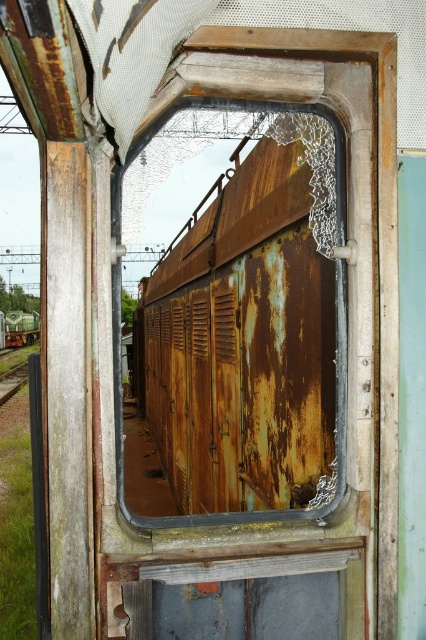
You are a maintenance worker inspecting the train car window. You notice the rusty metal train at left and the brown wooden train track at left. Which object is closer to the left edge of the window?

The rusty metal train at left is positioned on the left side of the brown wooden train track at left, so it is closer to the left edge of the window.

You are standing in front of two rusty metal trains. The first is the rusty metal train at center and the second is the rusty metal train at left. Which one is located to the right of the other?

The rusty metal train at center is positioned on the right side of the rusty metal train at left, so the rusty metal train at center is to the right of the rusty metal train at left.

You are standing in front of an old train car window and notice two points marked on the window. One is at coordinate point (163, 284) and the other is at point (25, 326). Which point is closer to your eyes?

Point (163, 284) is closer to the camera than point (25, 326), so the point at (163, 284) is closer to your eyes.